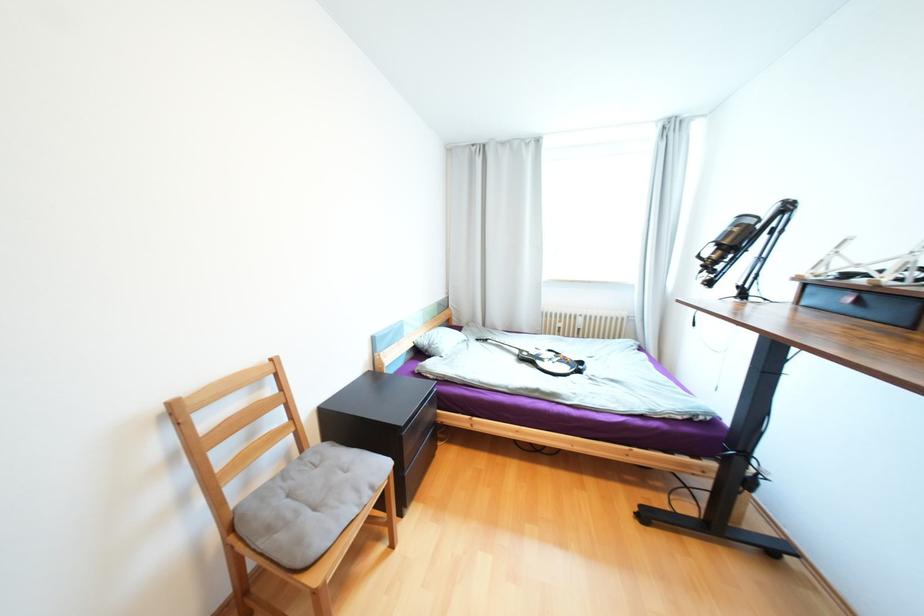
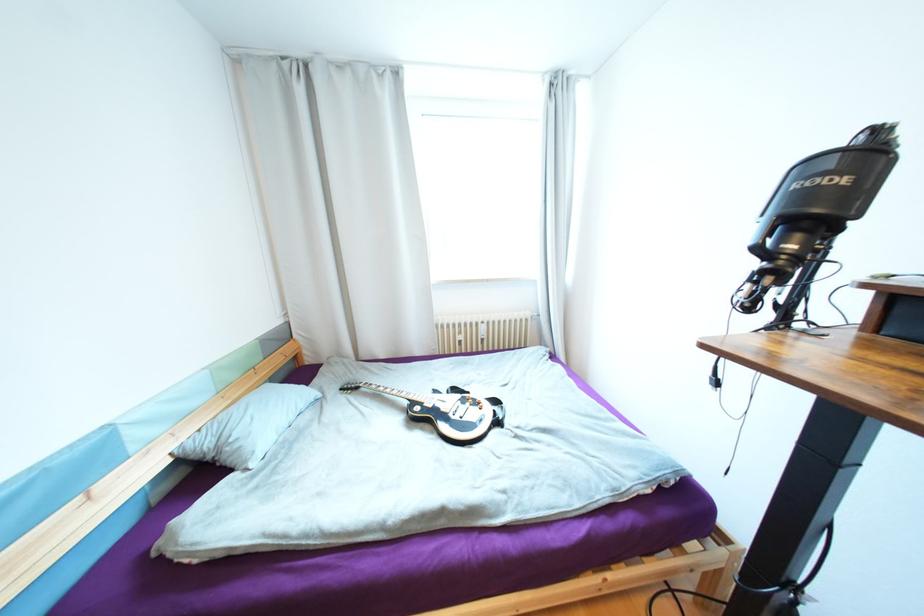
What movement of the cameraman would produce the second image?

The cameraman walked toward right, forward.